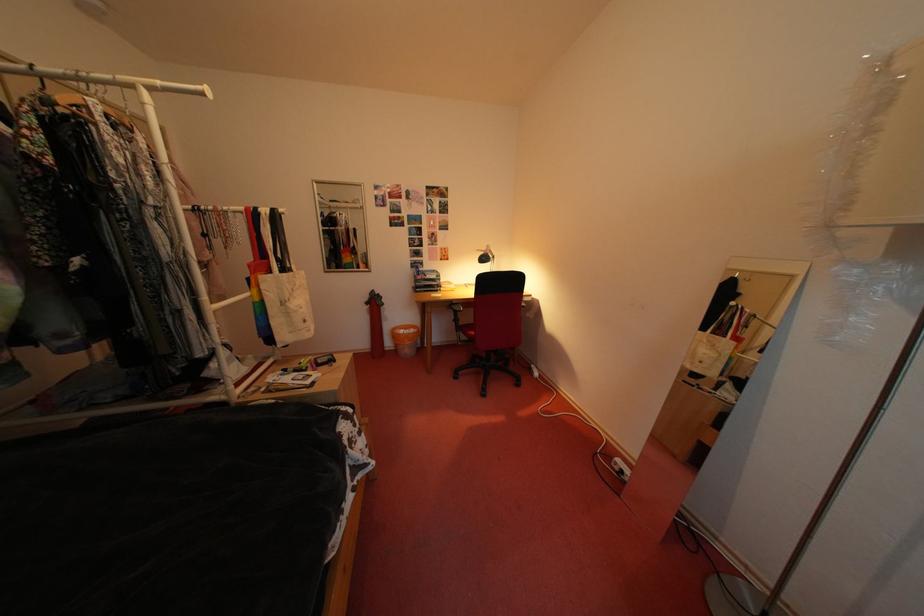
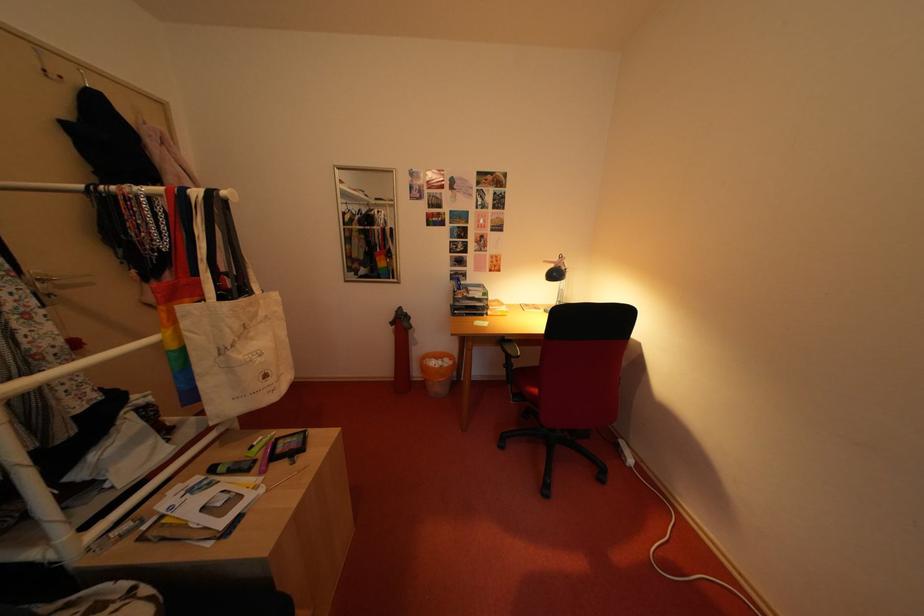
Locate, in the second image, the point that corresponds to point (266, 305) in the first image.

(184, 352)